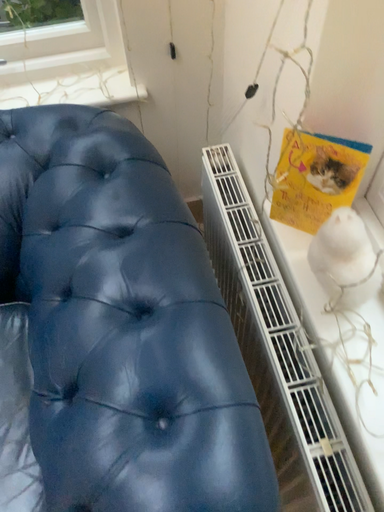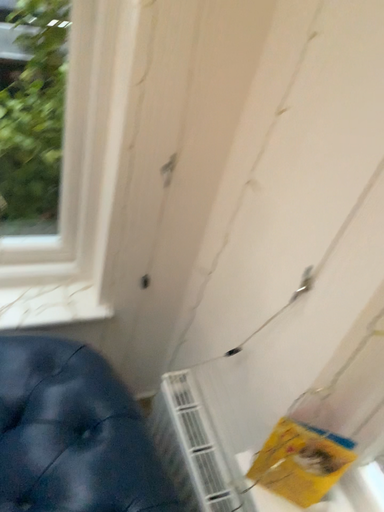
Question: How did the camera likely rotate when shooting the video?

Choices:
 (A) rotated downward
 (B) rotated upward

Answer: (B)